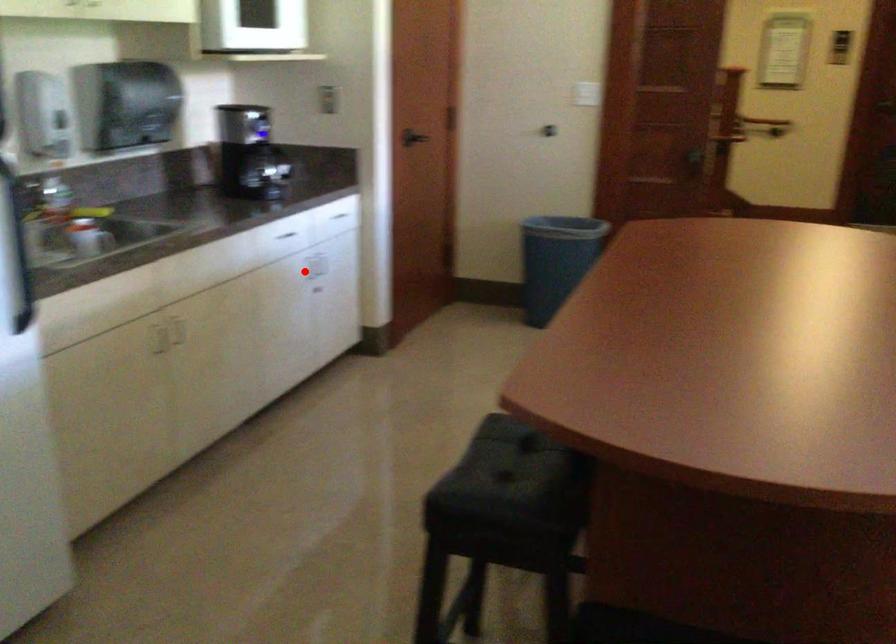
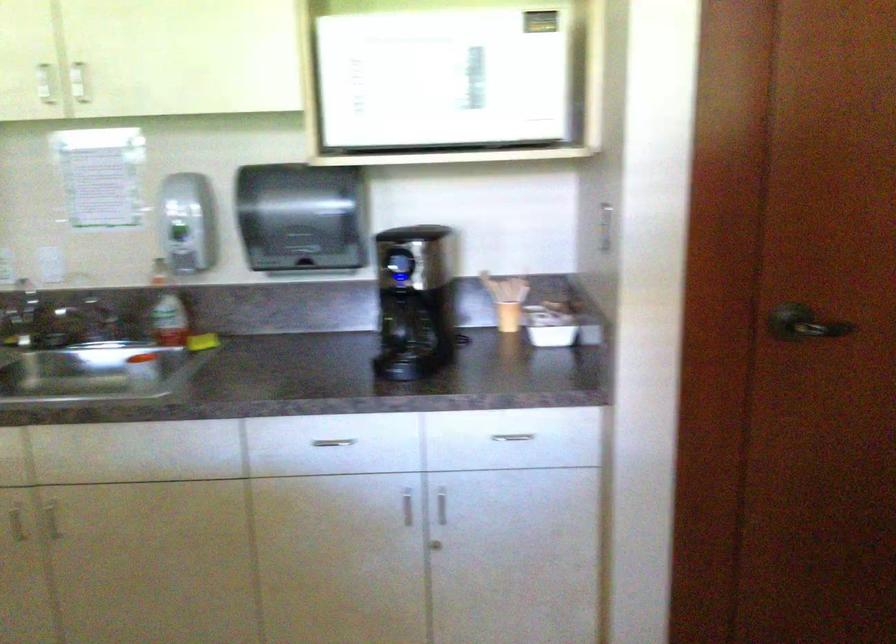
Find the pixel in the second image that matches the highlighted location in the first image.

(407, 506)